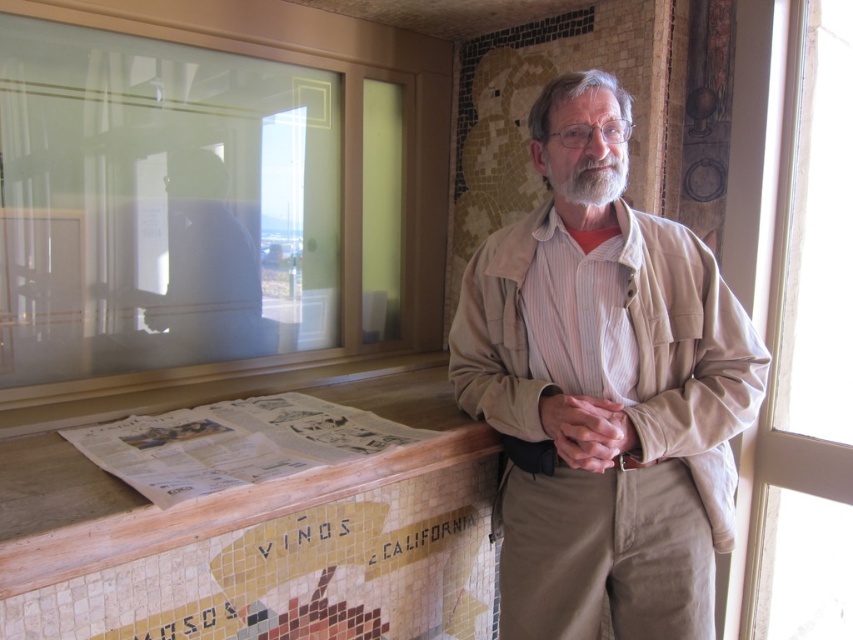
Based on the photo, you are a tailor who needs to determine if the tan fabric jacket at center can fit into a storage box designed for items smaller than the wooden at lower left. Can the jacket fit?

The tan fabric jacket at center is smaller than wooden at lower left, so it can fit into the storage box designed for items smaller than the wooden at lower left.

You are standing in the room and see the point at coordinates (234, 444). What object is located at that point?

The point at coordinates (234, 444) corresponds to the white printed newspaper at lower center.

You are a delivery person standing at the entrance of a wine shop. You need to place a large package on the wooden at lower left and ensure it doesn not block the transparent glass window at right. Can you fit the package if it is 3.5 feet wide?

The wooden at lower left is 4.07 feet away from the transparent glass window at right. Since the package is 3.5 feet wide, which is less than the distance between them, it should fit without blocking the window.